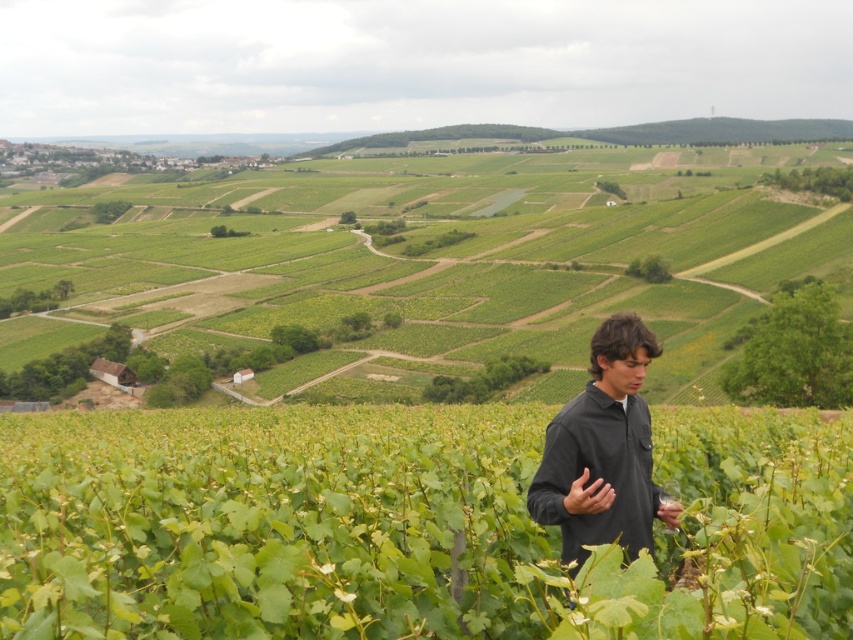
Question: Which point is closer to the camera?

Choices:
 (A) (490, 515)
 (B) (605, 320)
 (C) (152, 232)

Answer: (A)

Question: Which point is farther from the camera taking this photo?

Choices:
 (A) (610, 497)
 (B) (486, 212)

Answer: (B)

Question: From the image, what is the correct spatial relationship of green leafy vines at center in relation to black matte shirt at center?

Choices:
 (A) left
 (B) right

Answer: (A)

Question: Does green leafy vines at center have a larger size compared to black matte shirt at center?

Choices:
 (A) yes
 (B) no

Answer: (A)

Question: Which object is farther from the camera taking this photo?

Choices:
 (A) green leafy vineyard at lower center
 (B) green leafy vines at center
 (C) black matte shirt at center

Answer: (A)

Question: Is green leafy vines at center positioned at the back of black matte shirt at center?

Choices:
 (A) yes
 (B) no

Answer: (B)